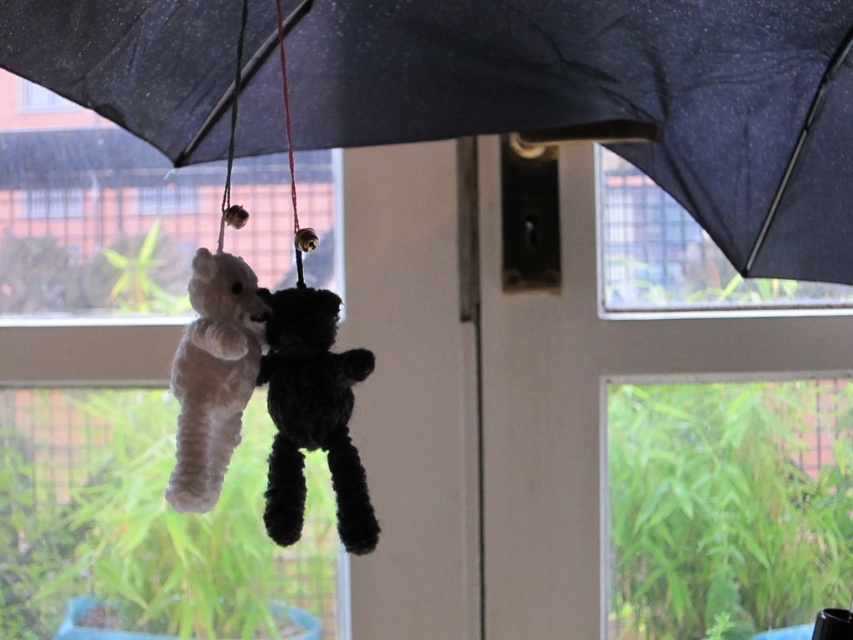
Question: Which point is closer to the camera taking this photo?

Choices:
 (A) (308, 426)
 (B) (74, 109)
 (C) (263, 145)

Answer: (A)

Question: Is black matte umbrella at upper center positioned before transparent glass window at upper center?

Choices:
 (A) yes
 (B) no

Answer: (A)

Question: Can you confirm if transparent glass window at upper center is wider than transparent glass window at upper left?

Choices:
 (A) yes
 (B) no

Answer: (A)

Question: Where is white fluffy teddy bear at center located in relation to transparent glass window at upper left in the image?

Choices:
 (A) below
 (B) above

Answer: (A)

Question: Which point is closer to the camera taking this photo?

Choices:
 (A) (642, 234)
 (B) (270, 349)
 (C) (189, 468)
 (D) (763, 97)

Answer: (C)

Question: Among these points, which one is nearest to the camera?

Choices:
 (A) (194, 468)
 (B) (309, 424)
 (C) (767, 308)
 (D) (39, 104)

Answer: (A)